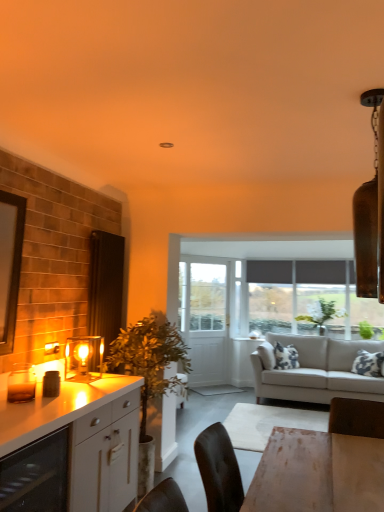
This screenshot has height=512, width=384. Identify the location of vacant space to the left of matte glass lampshade at left. (69, 376).